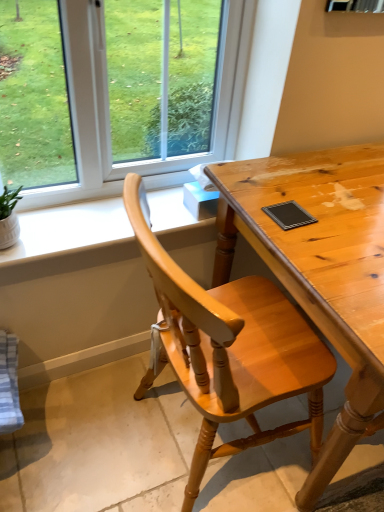
Question: Could you tell me if white matte window sill at upper left is turned towards light brown wooden desk at center?

Choices:
 (A) yes
 (B) no

Answer: (B)

Question: Considering the relative sizes of white matte window sill at upper left and light brown wooden desk at center in the image provided, is white matte window sill at upper left bigger than light brown wooden desk at center?

Choices:
 (A) yes
 (B) no

Answer: (B)

Question: Is white matte window sill at upper left shorter than light brown wooden desk at center?

Choices:
 (A) yes
 (B) no

Answer: (A)

Question: From the image's perspective, would you say white matte window sill at upper left is positioned over light brown wooden desk at center?

Choices:
 (A) no
 (B) yes

Answer: (B)

Question: Considering the relative sizes of white matte window sill at upper left and light brown wooden desk at center in the image provided, is white matte window sill at upper left smaller than light brown wooden desk at center?

Choices:
 (A) no
 (B) yes

Answer: (B)

Question: Is white matte window sill at upper left at the right side of light brown wooden desk at center?

Choices:
 (A) yes
 (B) no

Answer: (B)

Question: From the image's perspective, is light brown wooden desk at center under light brown wooden chair at center?

Choices:
 (A) no
 (B) yes

Answer: (A)

Question: Does light brown wooden desk at center have a lesser width compared to light brown wooden chair at center?

Choices:
 (A) no
 (B) yes

Answer: (A)

Question: Considering the relative positions of light brown wooden desk at center and light brown wooden chair at center in the image provided, is light brown wooden desk at center to the left of light brown wooden chair at center from the viewer's perspective?

Choices:
 (A) no
 (B) yes

Answer: (A)

Question: From a real-world perspective, is light brown wooden desk at center under light brown wooden chair at center?

Choices:
 (A) yes
 (B) no

Answer: (A)

Question: Is light brown wooden desk at center touching light brown wooden chair at center?

Choices:
 (A) no
 (B) yes

Answer: (A)

Question: Can you confirm if light brown wooden desk at center is smaller than light brown wooden chair at center?

Choices:
 (A) no
 (B) yes

Answer: (A)

Question: From the image's perspective, is white matte window sill at upper left under light brown wooden chair at center?

Choices:
 (A) no
 (B) yes

Answer: (A)